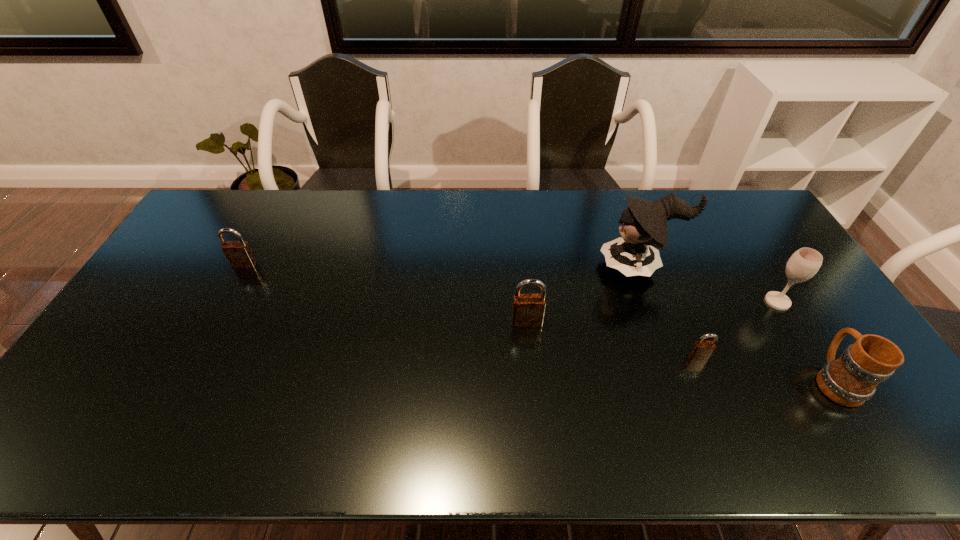
This screenshot has width=960, height=540. In order to click on free space that is in between the mug and the fourth nearest object in this screenshot , I will do `click(806, 341)`.

What are the coordinates of `vacant space that is in between the doll and the mug` in the screenshot? It's located at (737, 323).

This screenshot has width=960, height=540. Find the location of `free area in between the third farthest object and the shortest padlock`. free area in between the third farthest object and the shortest padlock is located at coordinates (737, 329).

I want to click on free space between the fourth nearest object and the doll, so click(708, 284).

This screenshot has width=960, height=540. Identify the location of free area in between the tallest object and the fifth object from right to left. (584, 294).

The width and height of the screenshot is (960, 540). I want to click on unoccupied position between the rightmost padlock and the leftmost padlock, so click(x=471, y=310).

Where is `free spot between the second object from left to right and the mug`? This screenshot has width=960, height=540. free spot between the second object from left to right and the mug is located at coordinates (681, 351).

This screenshot has width=960, height=540. Find the location of `object that stands as the second closest to the second object from left to right`. object that stands as the second closest to the second object from left to right is located at coordinates (701, 350).

Where is `the fifth closest object to the tallest object`? the fifth closest object to the tallest object is located at coordinates (238, 253).

Locate which padlock is the second closest to the farthest padlock. Please provide its 2D coordinates. Your answer should be formatted as a tuple, i.e. [(x, y)], where the tuple contains the x and y coordinates of a point satisfying the conditions above.

[(701, 350)]